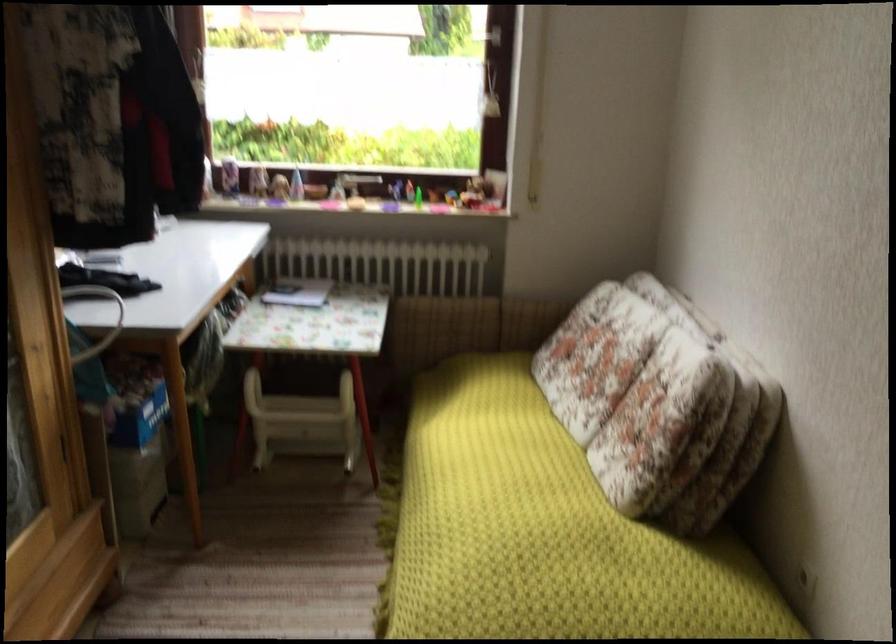
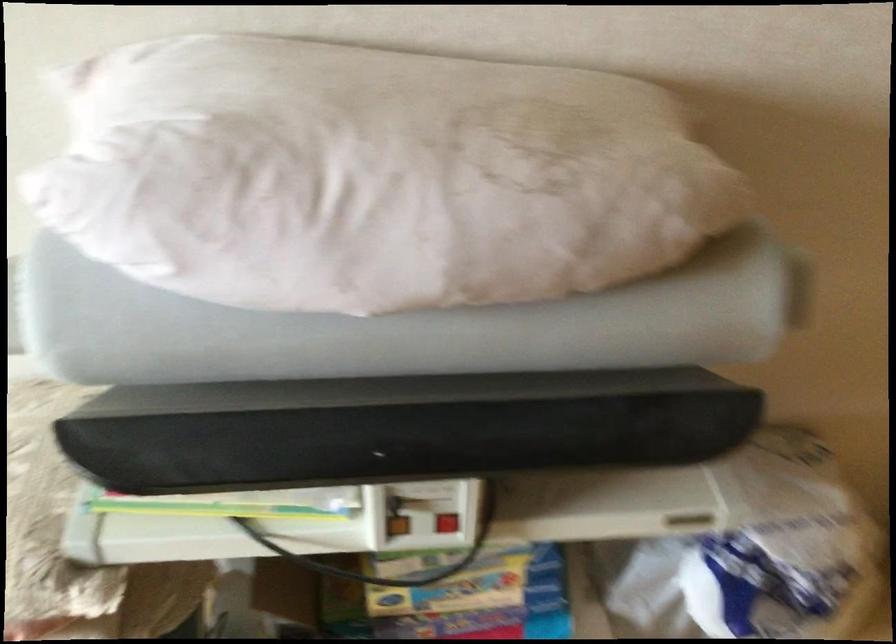
Based on the continuous images, in which direction is the camera rotating?

The camera rotated toward right-down.